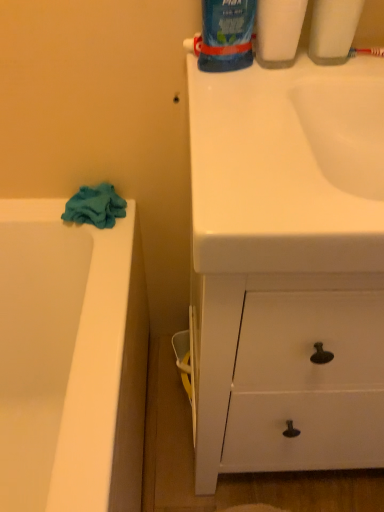
This screenshot has height=512, width=384. What are the coordinates of `free space to the left of red plastic toothbrush at upper right` in the screenshot? It's located at (310, 77).